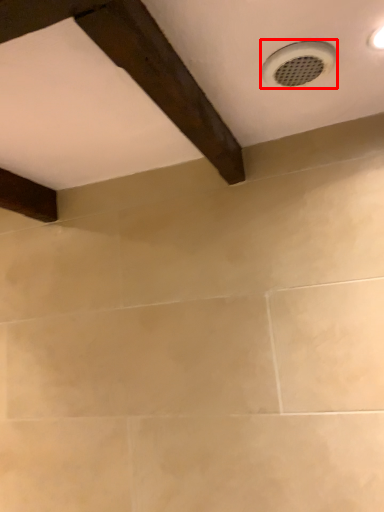
Question: From the image's perspective, where is plumbing fixture (annotated by the red box) located relative to exhaust hood?

Choices:
 (A) below
 (B) above

Answer: (B)